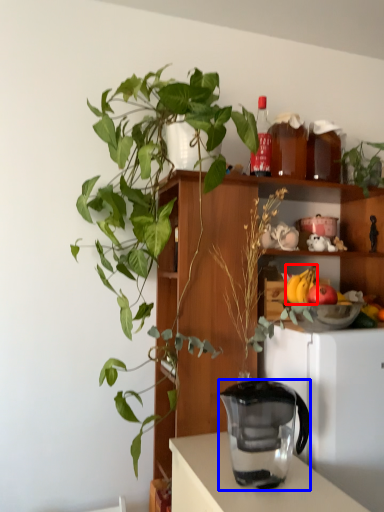
Question: Which of the following is the closest to the observer, banana (highlighted by a red box) or jug (highlighted by a blue box)?

Choices:
 (A) banana
 (B) jug

Answer: (B)